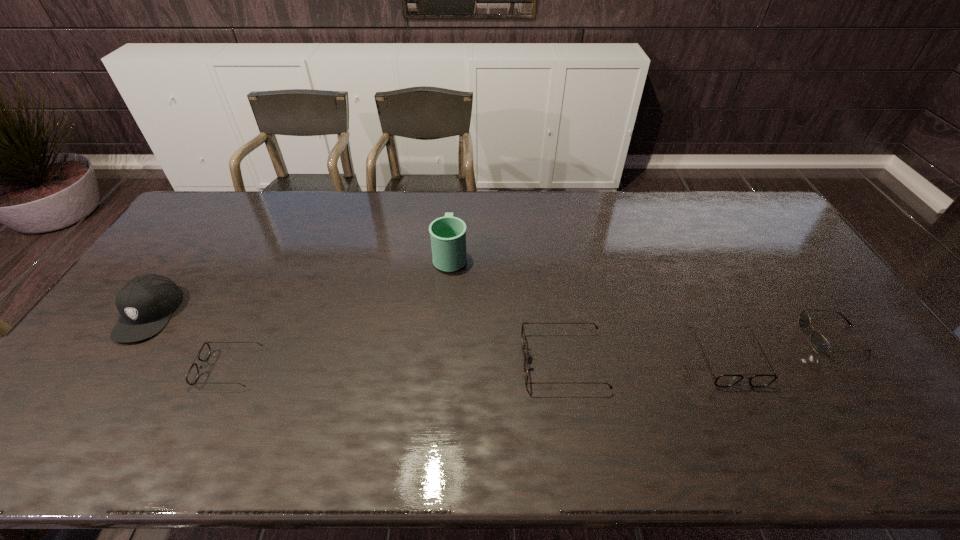
In the image, there is a desktop. Find the location of `free space at the far left corner`. free space at the far left corner is located at coordinates (244, 201).

In the image, there is a desktop. At what (x,y) coordinates should I click in order to perform the action: click on free region at the near right corner. Please return your answer as a coordinate pair (x, y). The height and width of the screenshot is (540, 960). Looking at the image, I should click on (908, 395).

You are a GUI agent. You are given a task and a screenshot of the screen. Output one action in this format:
    pyautogui.click(x=<x>, y=<y>)
    Task: Click on the free area in between the rightmost sunglasses and the second sunglasses from right to left
    Image resolution: width=960 pixels, height=540 pixels.
    Given the screenshot: What is the action you would take?
    pyautogui.click(x=780, y=348)

At what (x,y) coordinates should I click in order to perform the action: click on free space between the rightmost sunglasses and the third sunglasses from left to right. Please return your answer as a coordinate pair (x, y). This screenshot has height=540, width=960. Looking at the image, I should click on (780, 348).

Locate an element on the screen. vacant area between the rightmost object and the second object from right to left is located at coordinates (780, 348).

The width and height of the screenshot is (960, 540). In order to click on free space between the fifth object from left to right and the rightmost sunglasses in this screenshot , I will do `click(780, 348)`.

This screenshot has height=540, width=960. Find the location of `free space between the rightmost sunglasses and the leftmost object`. free space between the rightmost sunglasses and the leftmost object is located at coordinates (491, 326).

Where is `free space between the leftmost object and the third object from right to left`? The image size is (960, 540). free space between the leftmost object and the third object from right to left is located at coordinates (356, 338).

Find the location of a particular element. vacant area that lies between the rightmost sunglasses and the fifth shortest object is located at coordinates (491, 326).

At what (x,y) coordinates should I click in order to perform the action: click on free space between the rightmost sunglasses and the mug. Please return your answer as a coordinate pair (x, y). The height and width of the screenshot is (540, 960). Looking at the image, I should click on (641, 296).